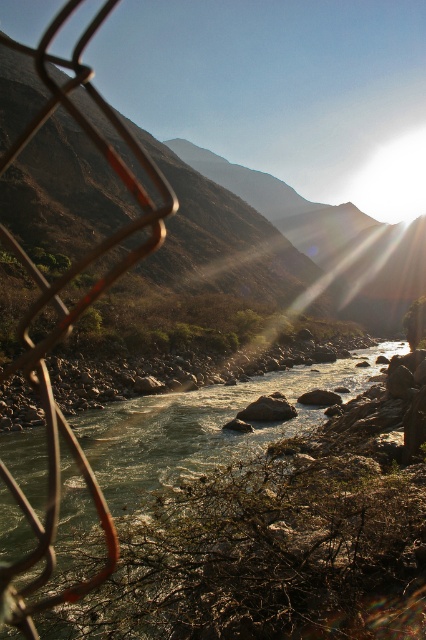
Between point (117, 492) and point (311, 252), which one is positioned in front?

Point (117, 492) is more forward.

Who is positioned more to the right, greenish-brown rocky stream at center or brown/dry grassy mountain at upper center?

From the viewer's perspective, brown/dry grassy mountain at upper center appears more on the right side.

Is point (236, 397) positioned behind point (305, 252)?

No, (236, 397) is closer to viewer.

Where is `greenish-brown rocky stream at center`? Image resolution: width=426 pixels, height=640 pixels. greenish-brown rocky stream at center is located at coordinates (203, 422).